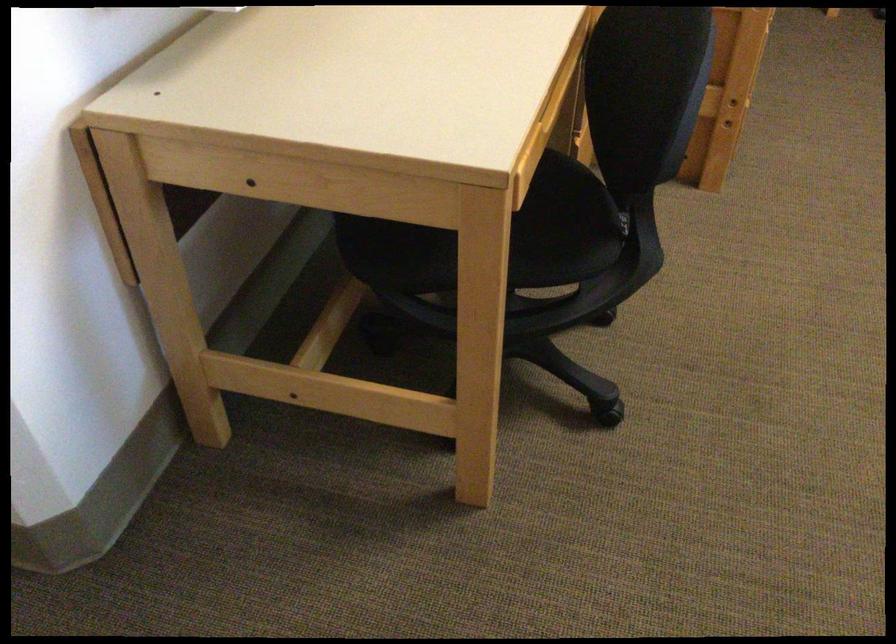
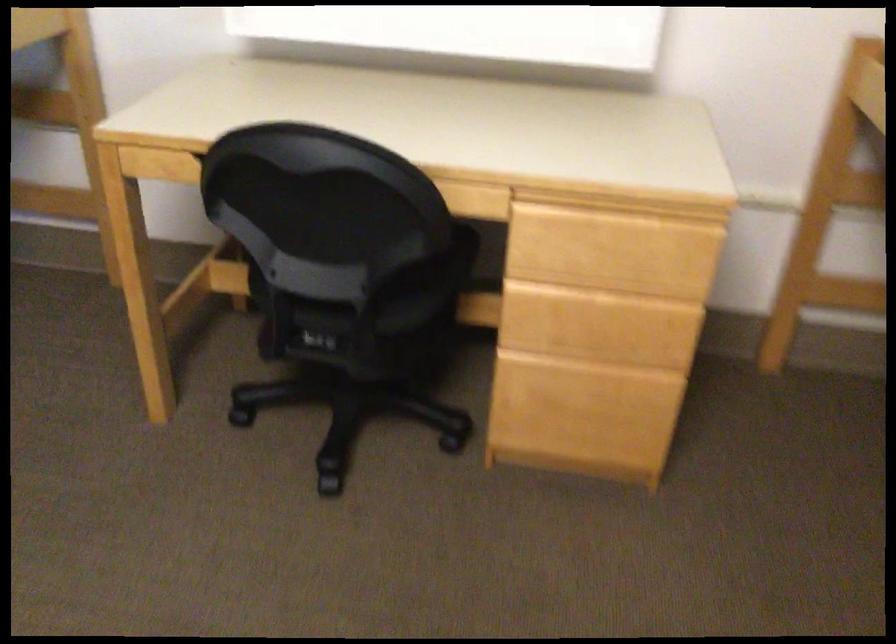
In a continuous first-person perspective shot, in which direction is the camera moving?

The cameraman walked toward right, forward.